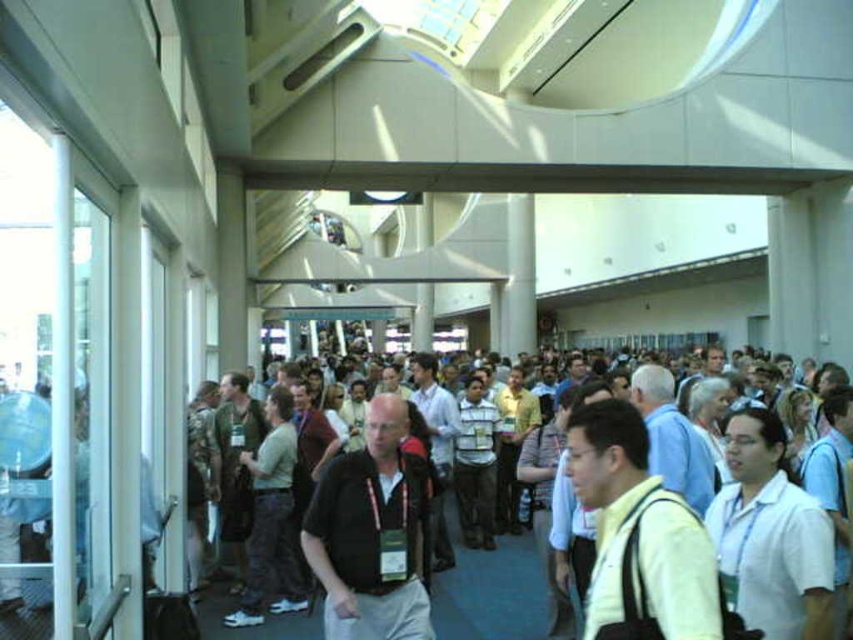
Question: Which of the following is the closest to the observer?

Choices:
 (A) yellow matte shirt at center
 (B) light blue shirt at center
 (C) matte black shirt at center

Answer: (A)

Question: Is yellow matte shirt at center to the left of light blue shirt at center from the viewer's perspective?

Choices:
 (A) no
 (B) yes

Answer: (A)

Question: Can you confirm if matte black shirt at center is positioned below light blue shirt at center?

Choices:
 (A) yes
 (B) no

Answer: (B)

Question: Which object is farther from the camera taking this photo?

Choices:
 (A) light blue shirt at center
 (B) matte black shirt at center
 (C) yellow matte shirt at center

Answer: (A)

Question: Does matte black shirt at center appear on the left side of light blue shirt at center?

Choices:
 (A) yes
 (B) no

Answer: (A)

Question: Which object is farther from the camera taking this photo?

Choices:
 (A) yellow matte shirt at center
 (B) matte black shirt at center

Answer: (B)